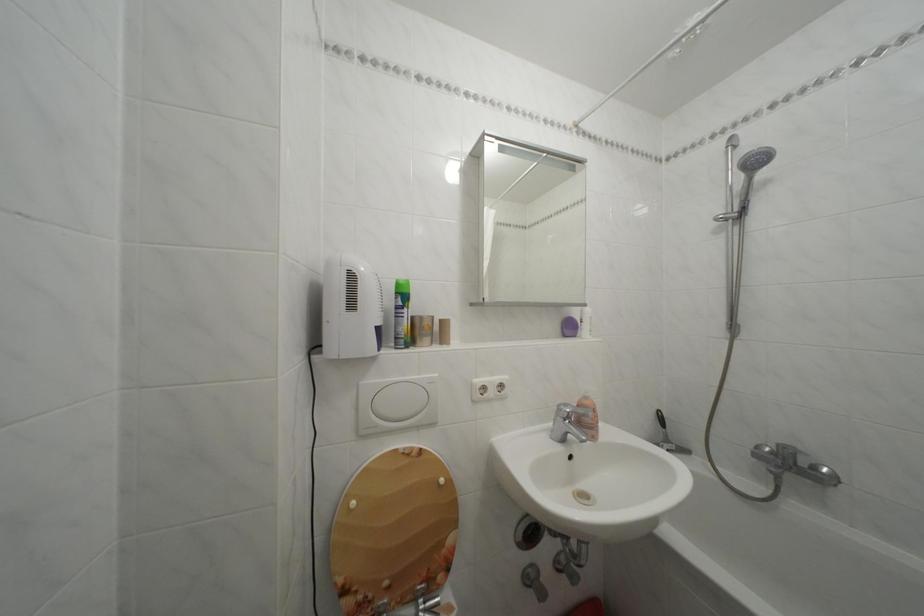
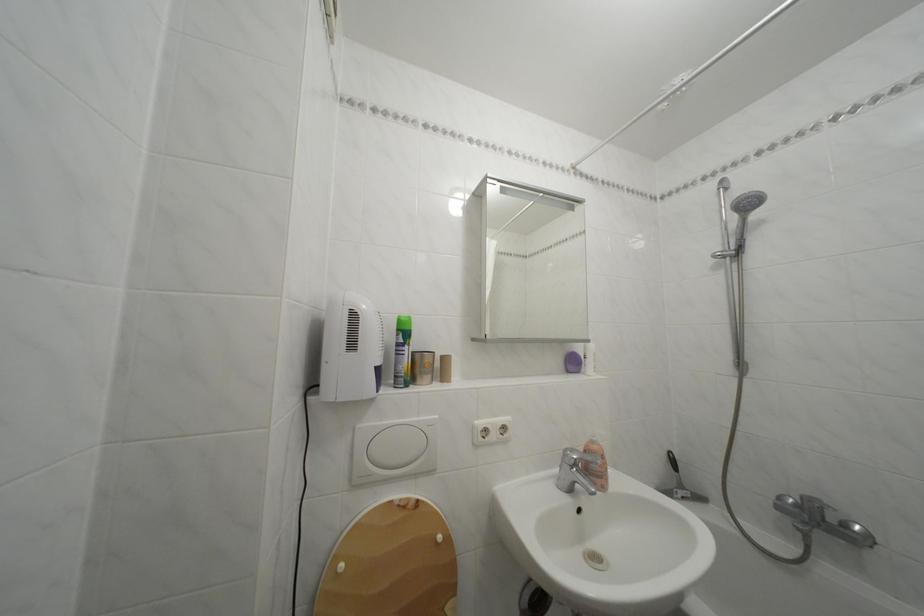
Find the pixel in the second image that matches point (594, 403) in the first image.

(602, 448)